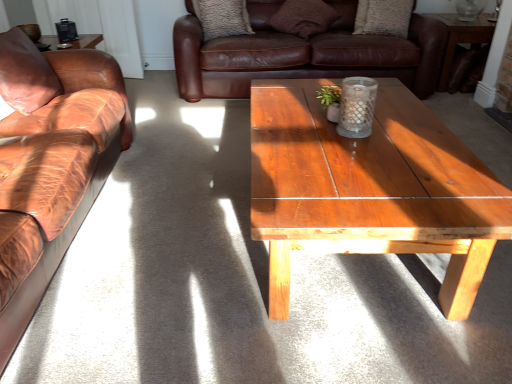
In order to face leather pillow at left, which appears as the first pillow when viewed from the front, should I rotate leftwards or rightwards?

A 28.715 degree turn to the left will do.

Locate an element on the screen. The width and height of the screenshot is (512, 384). leather pillow at left, acting as the 1th pillow starting from the left is located at coordinates (25, 73).

Find the location of `leather pillow at left, which is counted as the fourth pillow, starting from the back`. leather pillow at left, which is counted as the fourth pillow, starting from the back is located at coordinates (25, 73).

From a real-world perspective, who is located higher, transparent glass vase at upper right or brown leather couch at left, the 2th studio couch positioned from the right?

From a 3D spatial view, transparent glass vase at upper right is above.

Is transparent glass vase at upper right not within brown leather couch at left, the second studio couch in the top-to-bottom sequence?

Indeed, transparent glass vase at upper right is completely outside brown leather couch at left, the second studio couch in the top-to-bottom sequence.

Is transparent glass vase at upper right facing towards brown leather couch at left, the 2th studio couch positioned from the right?

No, transparent glass vase at upper right is not turned towards brown leather couch at left, the 2th studio couch positioned from the right.

From the image's perspective, between transparent glass vase at upper right and brown leather couch at left, which is the 1th studio couch in bottom-to-top order, which one is located above?

transparent glass vase at upper right.

Is point (467, 1) farther from camera compared to point (453, 16)?

No, it is in front of (453, 16).

How different are the orientations of transparent glass vase at upper right and wooden table at upper right in degrees?

0.443 degrees.

From a real-world perspective, is transparent glass vase at upper right below wooden table at upper right?

Incorrect, from a real-world perspective, transparent glass vase at upper right is higher than wooden table at upper right.

Would you say transparent glass vase at upper right contains wooden table at upper right?

No, wooden table at upper right is not a part of transparent glass vase at upper right.

From the picture: From the image's perspective, which is below, textured brown pillow at upper center, positioned as the 3th pillow in front-to-back order, or transparent glass vase at upper right?

textured brown pillow at upper center, positioned as the 3th pillow in front-to-back order, appears lower in the image.

Who is bigger, textured brown pillow at upper center, the third pillow positioned from the right, or transparent glass vase at upper right?

Bigger between the two is textured brown pillow at upper center, the third pillow positioned from the right.

Is textured brown pillow at upper center, the third pillow positioned from the right, placed right next to transparent glass vase at upper right?

They are not placed beside each other.

Considering the relative sizes of brown suede pillow at upper center, marked as the second pillow in a right-to-left arrangement, and wooden table at upper right in the image provided, is brown suede pillow at upper center, marked as the second pillow in a right-to-left arrangement, taller than wooden table at upper right?

No, brown suede pillow at upper center, marked as the second pillow in a right-to-left arrangement, is not taller than wooden table at upper right.

How many degrees apart are the facing directions of brown suede pillow at upper center, marked as the second pillow in a right-to-left arrangement, and wooden table at upper right?

There is a 4.16-degree angle between the facing directions of brown suede pillow at upper center, marked as the second pillow in a right-to-left arrangement, and wooden table at upper right.

Is brown suede pillow at upper center, marked as the second pillow in a right-to-left arrangement, aimed at wooden table at upper right?

No.

Which of these two, brown suede pillow at upper center, the third pillow from the back, or wooden table at upper right, is bigger?

wooden table at upper right is bigger.

Would you consider transparent glass vase at upper right to be distant from brown suede pillow at upper center, marked as the second pillow in a right-to-left arrangement?

Indeed, transparent glass vase at upper right is not near brown suede pillow at upper center, marked as the second pillow in a right-to-left arrangement.

Is transparent glass vase at upper right turned away from brown suede pillow at upper center, the third pillow from the back?

No, transparent glass vase at upper right is not facing the opposite direction of brown suede pillow at upper center, the third pillow from the back.

Considering the sizes of objects transparent glass vase at upper right and brown suede pillow at upper center, the third pillow from the back, in the image provided, who is taller, transparent glass vase at upper right or brown suede pillow at upper center, the third pillow from the back,?

Standing taller between the two is brown suede pillow at upper center, the third pillow from the back.

Is point (462, 20) positioned in front of point (295, 25)?

Yes, it is in front of point (295, 25).

Is brown suede pillow at upper center, the third pillow from the back, bigger than textured brown pillow at upper center, the second pillow when ordered from back to front?

Correct, brown suede pillow at upper center, the third pillow from the back, is larger in size than textured brown pillow at upper center, the second pillow when ordered from back to front.

Which is farther, (x=273, y=16) or (x=243, y=28)?

The point (x=273, y=16) is farther from the camera.

Measure the distance between brown suede pillow at upper center, marked as the second pillow in a right-to-left arrangement, and textured brown pillow at upper center, which ranks as the 2th pillow in left-to-right order.

They are 17.54 inches apart.

Is brown suede pillow at upper center, marked as the second pillow in a right-to-left arrangement, far away from textured brown pillow at upper center, which ranks as the 2th pillow in left-to-right order?

brown suede pillow at upper center, marked as the second pillow in a right-to-left arrangement, is near textured brown pillow at upper center, which ranks as the 2th pillow in left-to-right order, not far away.

Could you tell me if brown leather couch at center, acting as the first studio couch starting from the right, is facing wooden table at upper right?

No, brown leather couch at center, acting as the first studio couch starting from the right, is not facing towards wooden table at upper right.

Considering the points (431, 24) and (483, 20), which point is in front, point (431, 24) or point (483, 20)?

The point (431, 24) is more forward.

From a real-world perspective, is brown leather couch at center, arranged as the first studio couch when viewed from the back, above or below wooden table at upper right?

Clearly, from a real-world perspective, brown leather couch at center, arranged as the first studio couch when viewed from the back, is above wooden table at upper right.

Is brown leather couch at center, arranged as the first studio couch when viewed from the back, further to the viewer compared to wooden table at upper right?

No.

At what (x,y) coordinates should I click in order to perform the action: click on glass vase positioned vertically above the brown leather couch at left, acting as the first studio couch starting from the front (from a real-world perspective). Please return your answer as a coordinate pair (x, y). The image size is (512, 384). Looking at the image, I should click on (469, 9).

This screenshot has height=384, width=512. What are the coordinates of `table on the right of the transparent glass vase at upper right` in the screenshot? It's located at (461, 38).

Which object lies further to the anchor point brown leather couch at center, which ranks as the second studio couch in front-to-back order, brown leather couch at left, the second studio couch in the top-to-bottom sequence, or wooden table at upper right?

brown leather couch at left, the second studio couch in the top-to-bottom sequence, is further to brown leather couch at center, which ranks as the second studio couch in front-to-back order.

Looking at the image, which one is located closer to brown leather couch at left, the first studio couch from the left, wooden table at upper right or textured brown pillow at upper center, which ranks as the 2th pillow in left-to-right order?

textured brown pillow at upper center, which ranks as the 2th pillow in left-to-right order, is positioned closer to the anchor brown leather couch at left, the first studio couch from the left.

Considering their positions, is leather pillow at left, which is counted as the fourth pillow, starting from the back, positioned further to wooden table at upper right than brown suede pillow at upper center, which ranks as the second pillow in front-to-back order?

leather pillow at left, which is counted as the fourth pillow, starting from the back, is positioned further to the anchor wooden table at upper right.

When comparing their distances from textured brown pillow at upper center, positioned as the 3th pillow in front-to-back order, does transparent glass vase at upper right or textured beige pillow at upper center, which appears as the 1th pillow when viewed from the back, seem closer?

The object closer to textured brown pillow at upper center, positioned as the 3th pillow in front-to-back order, is textured beige pillow at upper center, which appears as the 1th pillow when viewed from the back.

When comparing their distances from transparent glass vase at upper right, does wooden table at upper right or textured beige pillow at upper center, which is the 4th pillow in front-to-back order, seem closer?

wooden table at upper right.

From the image, which object appears to be nearer to brown suede pillow at upper center, the third pillow from the back, brown leather couch at center, marked as the 2th studio couch in a left-to-right arrangement, or wooden table at upper right?

Based on the image, brown leather couch at center, marked as the 2th studio couch in a left-to-right arrangement, appears to be nearer to brown suede pillow at upper center, the third pillow from the back.

Looking at the image, which one is located closer to wooden table at upper right, brown leather couch at left, the 2th studio couch positioned from the right, or textured brown pillow at upper center, which ranks as the 2th pillow in left-to-right order?

textured brown pillow at upper center, which ranks as the 2th pillow in left-to-right order, is closer to wooden table at upper right.

Looking at the image, which one is located further to textured brown pillow at upper center, the second pillow when ordered from back to front, wooden table at upper right or transparent glass vase at upper right?

transparent glass vase at upper right is further to textured brown pillow at upper center, the second pillow when ordered from back to front.

Locate an element on the screen. This screenshot has height=384, width=512. glass vase situated between textured brown pillow at upper center, positioned as the 3th pillow in front-to-back order, and wooden table at upper right from left to right is located at coordinates (469, 9).

At what (x,y) coordinates should I click in order to perform the action: click on glass vase located between brown leather couch at left, which ranks as the second studio couch in back-to-front order, and wooden table at upper right in the left-right direction. Please return your answer as a coordinate pair (x, y). This screenshot has width=512, height=384. Looking at the image, I should click on (469, 9).

This screenshot has height=384, width=512. In order to click on pillow between brown suede pillow at upper center, the third pillow from the back, and wooden table at upper right, in the horizontal direction in this screenshot , I will do `click(383, 17)`.

This screenshot has height=384, width=512. What are the coordinates of `studio couch between textured brown pillow at upper center, the third pillow positioned from the right, and textured beige pillow at upper center, which is the 4th pillow in front-to-back order, from left to right` in the screenshot? It's located at (303, 53).